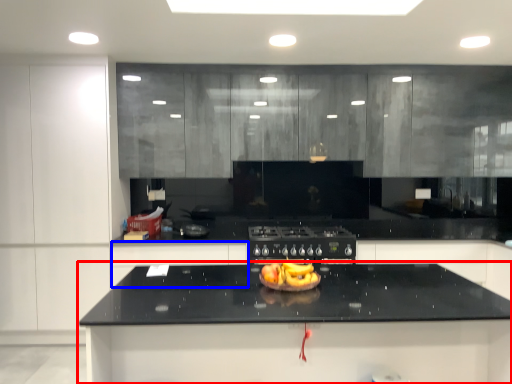
Question: Which point is closer to the camera, countertop (highlighted by a red box) or cabinetry (highlighted by a blue box)?

Choices:
 (A) countertop
 (B) cabinetry

Answer: (A)